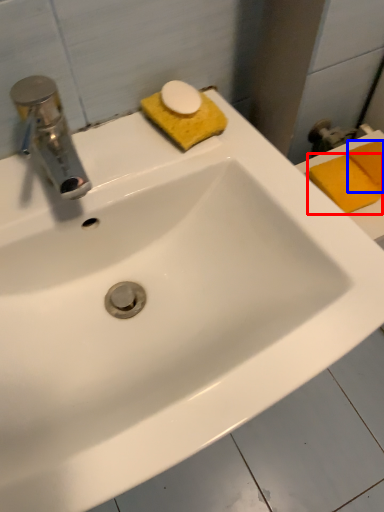
Question: Among these objects, which one is farthest to the camera, soap (highlighted by a red box) or soap (highlighted by a blue box)?

Choices:
 (A) soap
 (B) soap

Answer: (B)